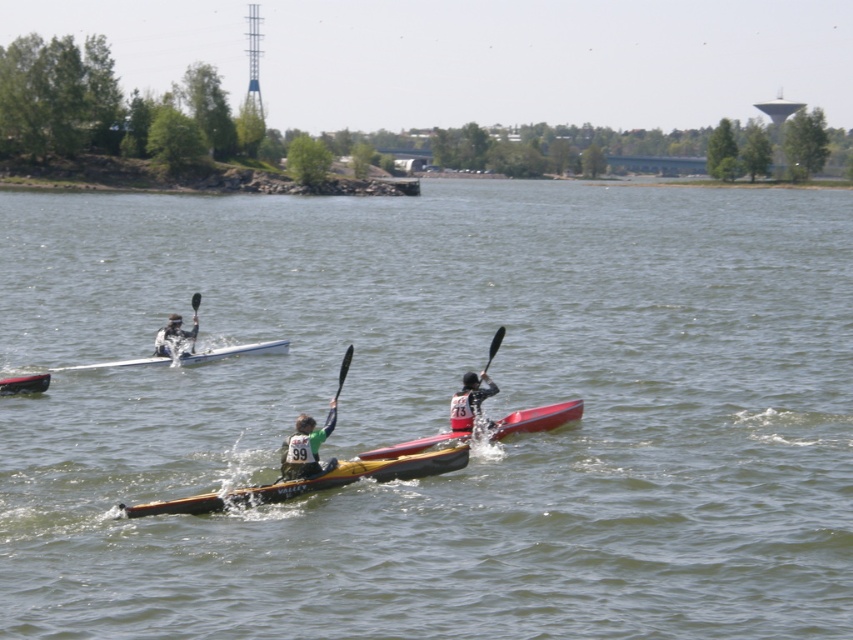
You are a spectator watching the kayaking event from the shore. You see the white plastic canoe at upper left and the green fabric kayak at center. Which one is positioned more to the right side of the scene?

The white plastic canoe at upper left is positioned more to the right side of the scene than the green fabric kayak at center.

You are organizing a kayaking event and need to store the yellow plastic canoe at center and the black rubber paddle at center in a storage container. Which object will require more space in the container?

The black rubber paddle at center requires more space than the yellow plastic canoe at center because the yellow plastic canoe at center occupies less space.